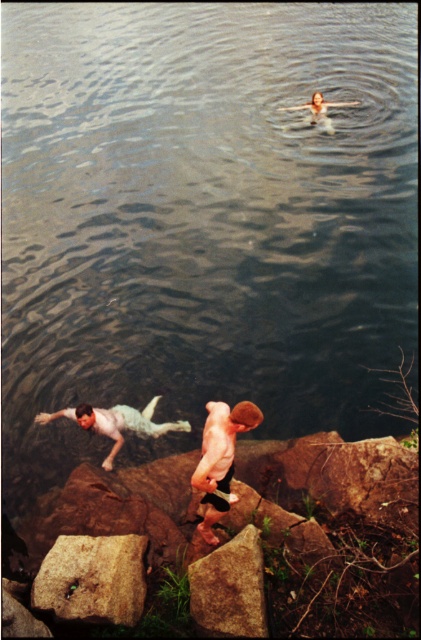
You are standing at the point with coordinates point (116, 436) and want to reach the point with coordinates point (216, 500). Which direction should you move in to get there?

You should move forward to reach point (216, 500) because it is in front of point (116, 436).

You are standing on the shore and want to reach the brown rough rock at center to place your bag. There is a rough textured rock at lower left in your path. Which rock should you step on first to reach your destination?

You should step on the rough textured rock at lower left first because the brown rough rock at center is behind it, so you need to step over the rough textured rock at lower left to reach the brown rough rock at center.

You are standing on the rough textured rock at lower left and want to reach the light blue fabric swim trunks at left. Can you jump to the swim trunks without touching the water?

The rough textured rock at lower left is 1.96 meters away from the light blue fabric swim trunks at left. Since the distance is quite far, jumping might be difficult and could result in falling into the water. It is not advisable to attempt the jump.